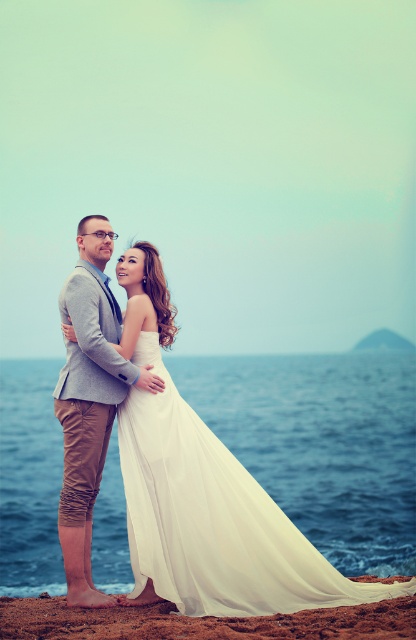
You are a photographer planning to capture a portrait of the couple in this beach setting. Considering the white chiffon dress at center and the light gray textured blazer at center, which clothing item should you focus on if you want to emphasize verticality in your composition?

The white chiffon dress at center has a greater height compared to the light gray textured blazer at center, so focusing on it would better emphasize verticality in the composition.

You are a photographer setting up for a beach wedding. You notice the light gray textured blazer at center and the brown sand at lower center. Which object is positioned to the left of the other?

The light gray textured blazer at center is to the left of brown sand at lower center.

You are a photographer setting up for a beach wedding photo shoot. You need to ensure that the light gray textured blazer at center is visible in the shot without being obscured by the brown sand at lower center. Given their sizes, which object should you focus on to achieve this?

The light gray textured blazer at center is larger in size than the brown sand at lower center, so focusing on the light gray textured blazer at center will ensure it remains visible and not obscured by the smaller brown sand at lower center.